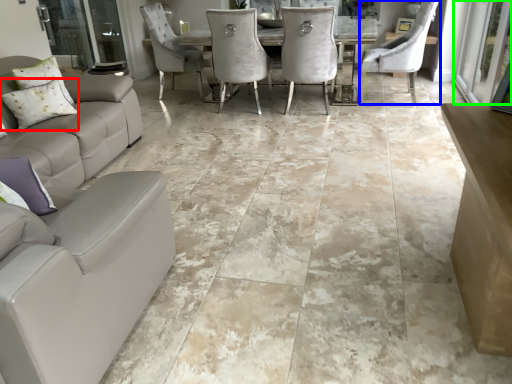
Question: Estimate the real-world distances between objects in this image. Which object is closer to pillow (highlighted by a red box), chair (highlighted by a blue box) or screen door (highlighted by a green box)?

Choices:
 (A) chair
 (B) screen door

Answer: (A)